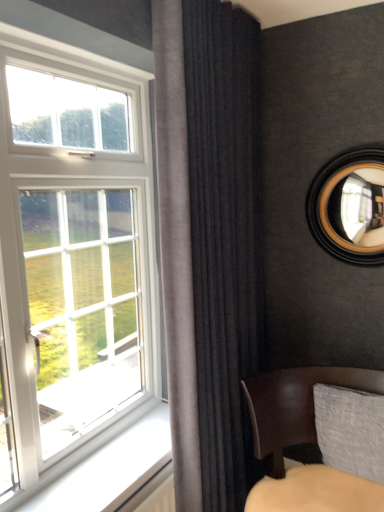
Question: Would you say wooden-framed mirror at upper right is outside dark velvet curtain at center?

Choices:
 (A) no
 (B) yes

Answer: (B)

Question: From the image's perspective, does wooden-framed mirror at upper right appear lower than dark velvet curtain at center?

Choices:
 (A) no
 (B) yes

Answer: (A)

Question: Is wooden-framed mirror at upper right to the right of dark velvet curtain at center from the viewer's perspective?

Choices:
 (A) yes
 (B) no

Answer: (A)

Question: Is dark velvet curtain at center completely or partially inside wooden-framed mirror at upper right?

Choices:
 (A) yes
 (B) no

Answer: (B)

Question: From a real-world perspective, does wooden-framed mirror at upper right sit lower than dark velvet curtain at center?

Choices:
 (A) no
 (B) yes

Answer: (A)

Question: Considering their positions, is wooden-framed mirror at upper right located in front of or behind dark velvet curtain at center?

Choices:
 (A) behind
 (B) front

Answer: (A)

Question: Is wooden-framed mirror at upper right to the left or to the right of dark velvet curtain at center in the image?

Choices:
 (A) left
 (B) right

Answer: (B)

Question: Considering the positions of point (324, 227) and point (240, 229), is point (324, 227) closer or farther from the camera than point (240, 229)?

Choices:
 (A) closer
 (B) farther

Answer: (B)

Question: In terms of height, does wooden-framed mirror at upper right look taller or shorter compared to dark velvet curtain at center?

Choices:
 (A) short
 (B) tall

Answer: (A)

Question: Is point (190, 211) positioned closer to the camera than point (332, 198)?

Choices:
 (A) closer
 (B) farther

Answer: (A)

Question: Based on their positions, is dark velvet curtain at center located to the left or right of wooden-framed mirror at upper right?

Choices:
 (A) left
 (B) right

Answer: (A)

Question: Would you say dark velvet curtain at center is inside or outside wooden-framed mirror at upper right?

Choices:
 (A) inside
 (B) outside

Answer: (B)

Question: Considering the positions of dark velvet curtain at center and wooden-framed mirror at upper right in the image, is dark velvet curtain at center taller or shorter than wooden-framed mirror at upper right?

Choices:
 (A) tall
 (B) short

Answer: (A)

Question: Based on their sizes in the image, would you say wooden-framed mirror at upper right is bigger or smaller than leather cushion at lower right?

Choices:
 (A) small
 (B) big

Answer: (A)

Question: Is wooden-framed mirror at upper right situated inside leather cushion at lower right or outside?

Choices:
 (A) outside
 (B) inside

Answer: (A)